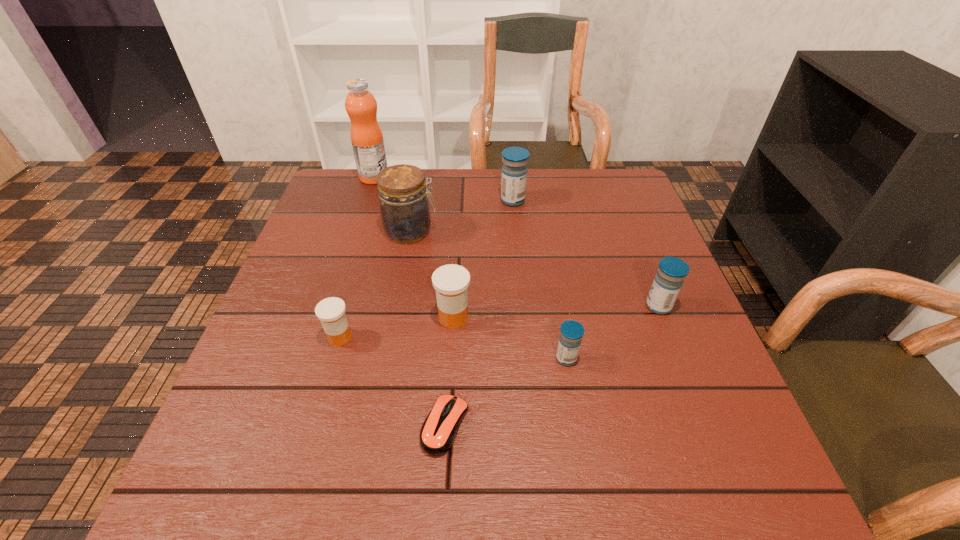
You are a GUI agent. You are given a task and a screenshot of the screen. Output one action in this format:
    pyautogui.click(x=<x>, y=<y>)
    Task: Click on the farthest object
    
    Given the screenshot: What is the action you would take?
    pyautogui.click(x=366, y=135)

What are the coordinates of `fruit juice` in the screenshot? It's located at (366, 135).

This screenshot has width=960, height=540. What are the coordinates of `jar` in the screenshot? It's located at (404, 207).

What are the coordinates of `the sixth object from right to left` in the screenshot? It's located at (404, 207).

What are the coordinates of `the farthest blue medicine` in the screenshot? It's located at (514, 170).

This screenshot has width=960, height=540. I want to click on the leftmost blue medicine, so click(514, 170).

At what (x,y) coordinates should I click in order to perform the action: click on the right orange medicine. Please return your answer as a coordinate pair (x, y). This screenshot has height=540, width=960. Looking at the image, I should click on click(x=451, y=282).

I want to click on the fourth medicine from right to left, so click(451, 282).

Find the location of a particular element. The image size is (960, 540). the rightmost medicine is located at coordinates (668, 281).

The image size is (960, 540). What are the coordinates of `the rightmost blue medicine` in the screenshot? It's located at (x=668, y=281).